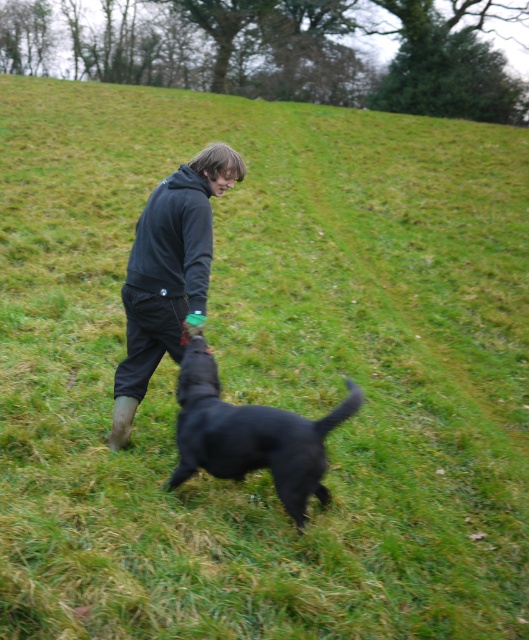
Can you confirm if dark gray hoodie at center is positioned to the left of black matte dog at center?

Indeed, dark gray hoodie at center is positioned on the left side of black matte dog at center.

What do you see at coordinates (168, 273) in the screenshot? This screenshot has width=529, height=640. I see `dark gray hoodie at center` at bounding box center [168, 273].

Locate an element on the screen. dark gray hoodie at center is located at coordinates (168, 273).